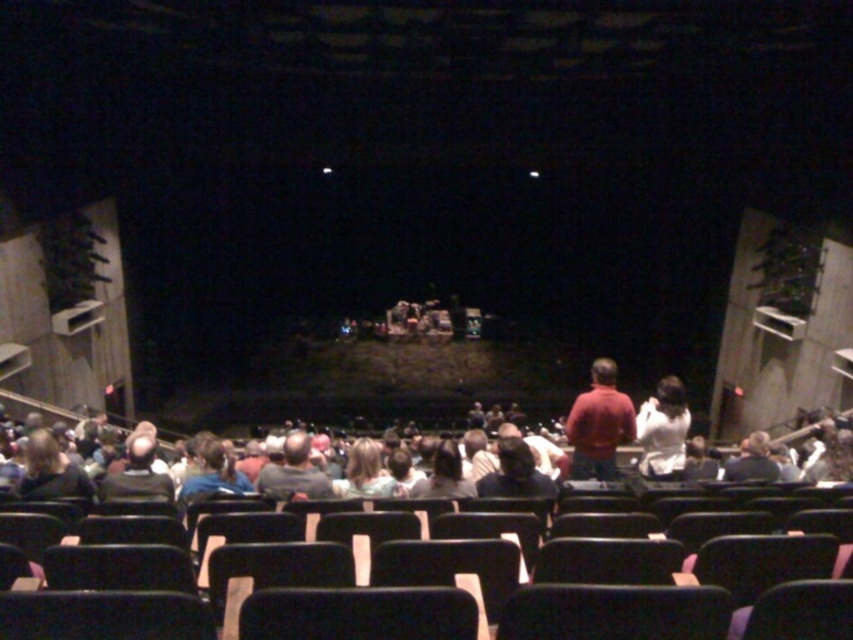
You are standing at the entrance of the theater and want to reach a specific point marked as point [584,442]. If your walking speed is 1.2 meters per second, how many seconds will it take you to reach that point?

The distance of point [584,442] from camera is 6.78 meters. At a walking speed of 1.2 meters per second, it will take approximately 5.65 seconds to reach the point.

You are an usher at the theater and need to guide a guest to their seat. The guest mentions they are wearing a dark gray shirt and are sitting in the center. You see both the matte red shirt at center and the dark gray shirt at center. Which shirt is more likely to be blocking the guest if they are sitting directly in front of the stage?

The matte red shirt at center might be wider than the dark gray shirt at center, so it is more likely to be blocking the guest if they are sitting directly in front of the stage.

You are sitting in the theater audience and notice two people in the front row. One is wearing a matte red shirt at center and the other a dark gray sweater at lower left. Which person is standing closer to the stage?

The matte red shirt at center is much taller than the dark gray sweater at lower left, so the person wearing the matte red shirt at center is standing closer to the stage.